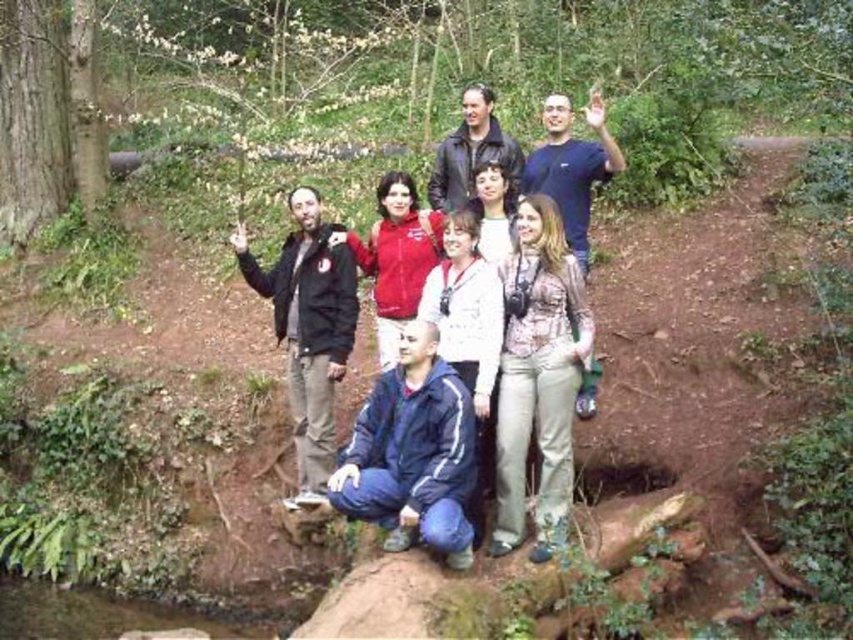
Is matte black jacket at center shorter than matte red jacket at center?

In fact, matte black jacket at center may be taller than matte red jacket at center.

Can you confirm if matte black jacket at center is positioned to the left of matte red jacket at center?

Incorrect, matte black jacket at center is not on the left side of matte red jacket at center.

Does point (564, 112) come behind point (363, 246)?

No, it is in front of (363, 246).

Identify the location of matte black jacket at center. (554, 193).

Between patterned fabric blouse at center and blue fabric jacket at center, which one has more height?

With more height is patterned fabric blouse at center.

Where is `patterned fabric blouse at center`? patterned fabric blouse at center is located at coordinates (538, 378).

Locate an element on the screen. The width and height of the screenshot is (853, 640). patterned fabric blouse at center is located at coordinates (538, 378).

Who is higher up, patterned fabric blouse at center or matte black jacket at center?

Positioned higher is matte black jacket at center.

Who is positioned more to the right, patterned fabric blouse at center or matte black jacket at center?

matte black jacket at center

At what (x,y) coordinates should I click in order to perform the action: click on patterned fabric blouse at center. Please return your answer as a coordinate pair (x, y). The width and height of the screenshot is (853, 640). Looking at the image, I should click on (538, 378).

I want to click on patterned fabric blouse at center, so click(538, 378).